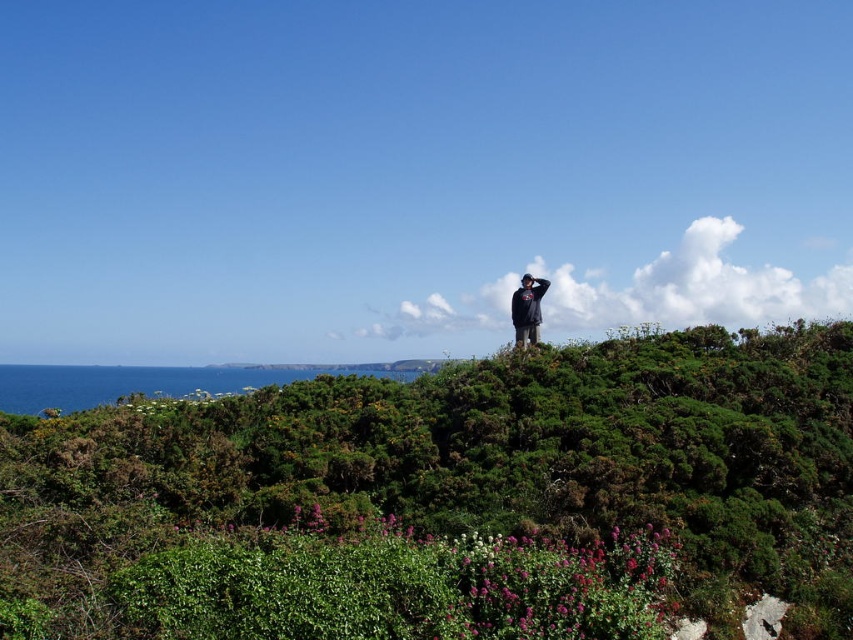
Please provide the 2D coordinates of the green leafy shrubs at center in the image coordinate system where the origin is at the bottom left corner of the image.

The 2D coordinates of the green leafy shrubs at center are at point (450, 499).